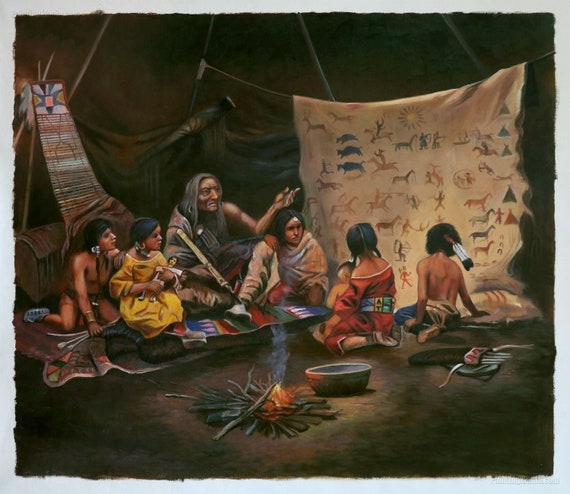
The image size is (570, 494). I want to click on doll, so tap(173, 261).